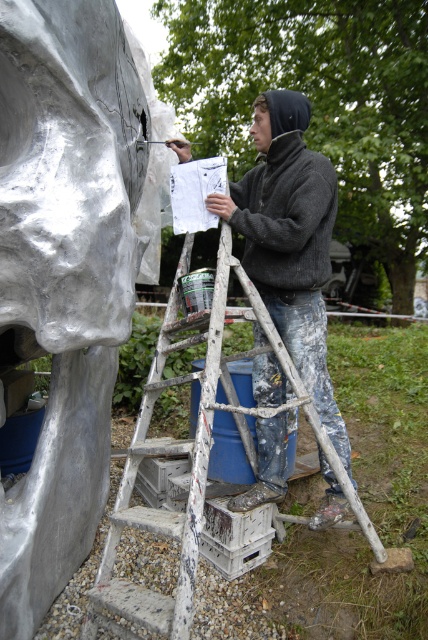
Is brushed metal sculpture at left to the right of white wooden ladder at center from the viewer's perspective?

Incorrect, brushed metal sculpture at left is not on the right side of white wooden ladder at center.

Can you confirm if brushed metal sculpture at left is positioned above white wooden ladder at center?

Indeed, brushed metal sculpture at left is positioned over white wooden ladder at center.

Who is more forward, (0, 284) or (104, 593)?

Positioned in front is point (0, 284).

The height and width of the screenshot is (640, 428). I want to click on brushed metal sculpture at left, so click(70, 266).

Is gray fabric jacket at center wider than white wooden ladder at center?

In fact, gray fabric jacket at center might be narrower than white wooden ladder at center.

Can you confirm if gray fabric jacket at center is positioned below white wooden ladder at center?

No, gray fabric jacket at center is not below white wooden ladder at center.

The image size is (428, 640). Identify the location of gray fabric jacket at center. (290, 241).

Is brushed metal sculpture at left to the right of gray fabric jacket at center from the viewer's perspective?

No, brushed metal sculpture at left is not to the right of gray fabric jacket at center.

Does brushed metal sculpture at left come behind gray fabric jacket at center?

That is False.

Locate an element on the screen. brushed metal sculpture at left is located at coordinates (70, 266).

Where is `brushed metal sculpture at left`? This screenshot has width=428, height=640. brushed metal sculpture at left is located at coordinates tap(70, 266).